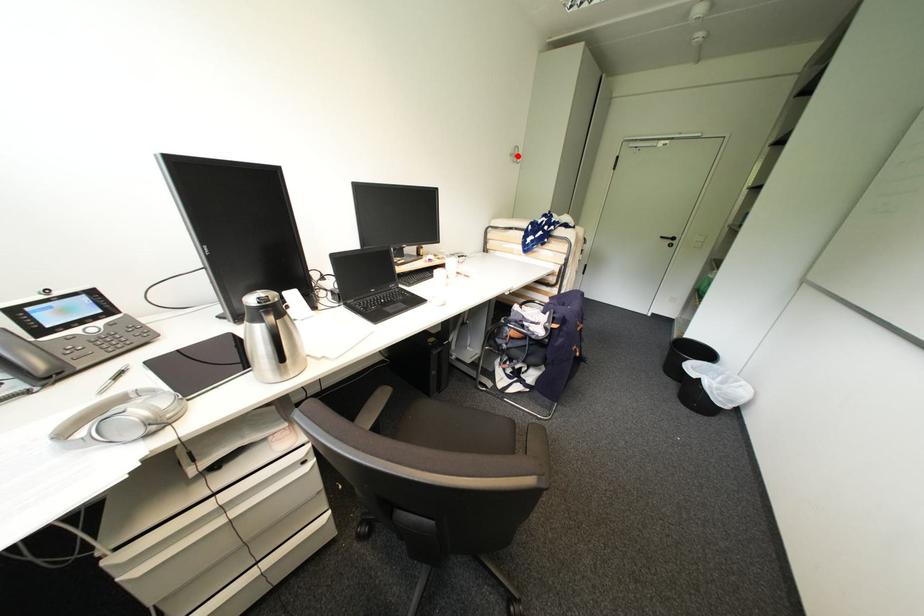
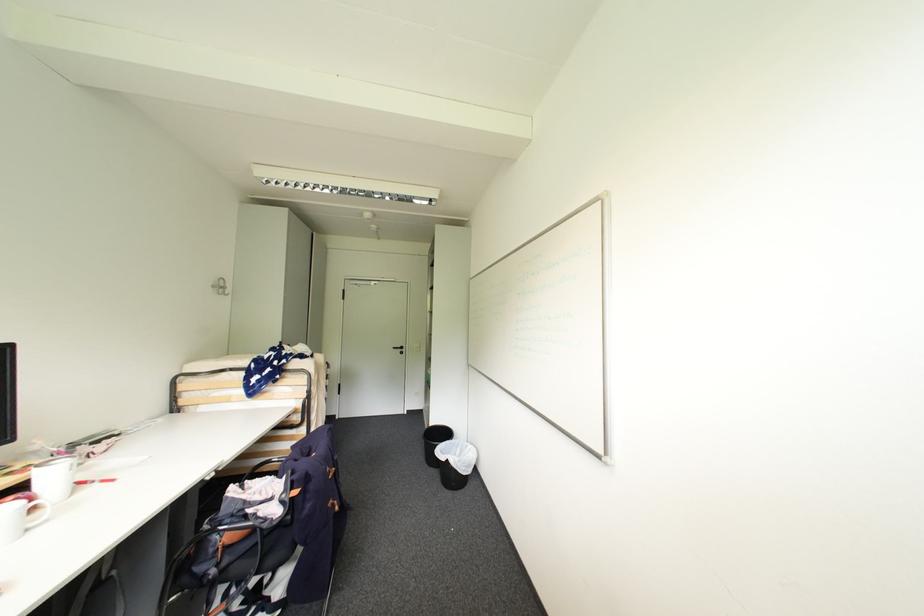
Where in the second image is the point corresponding to the highlighted location from the first image?

(220, 286)